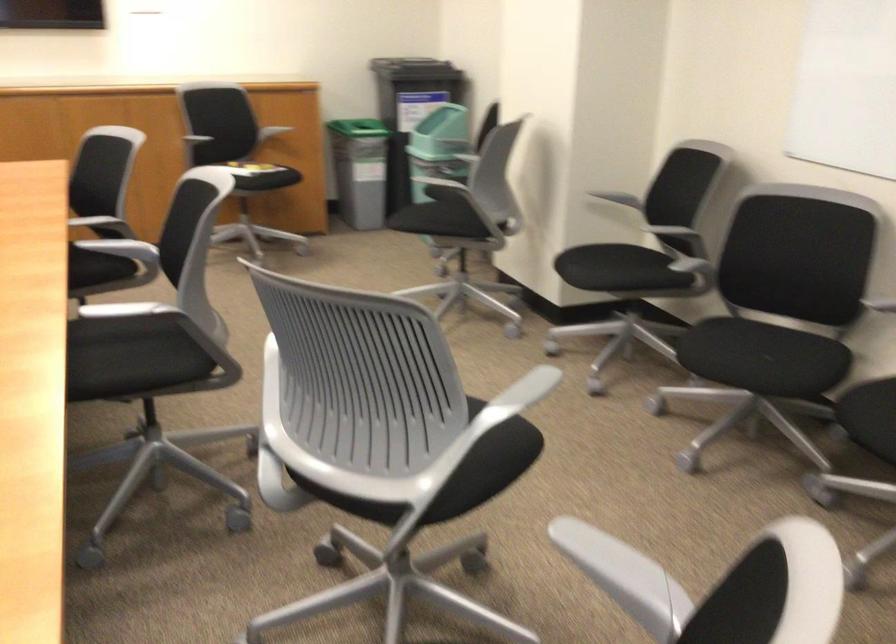
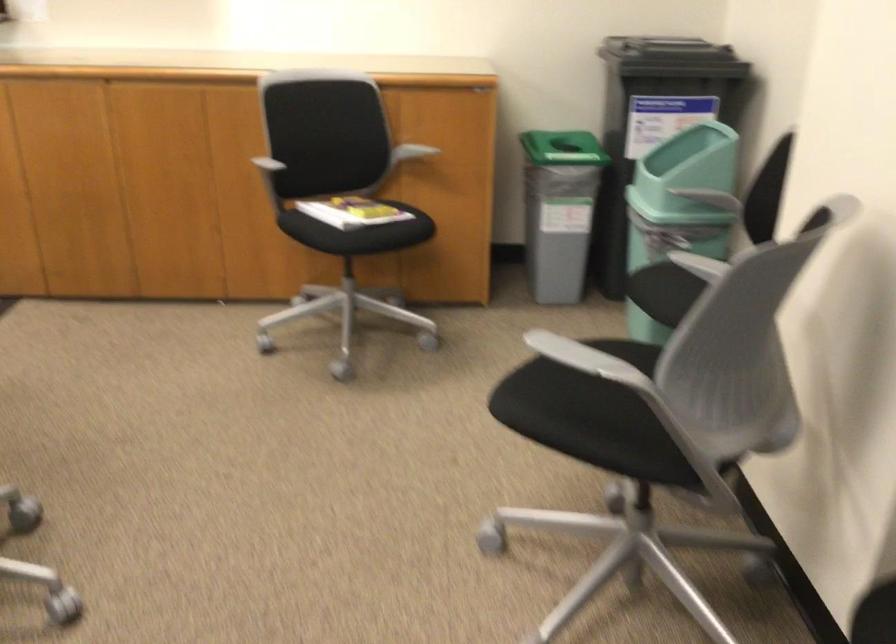
In the second image, find the point that corresponds to point 446,129 in the first image.

(678, 207)